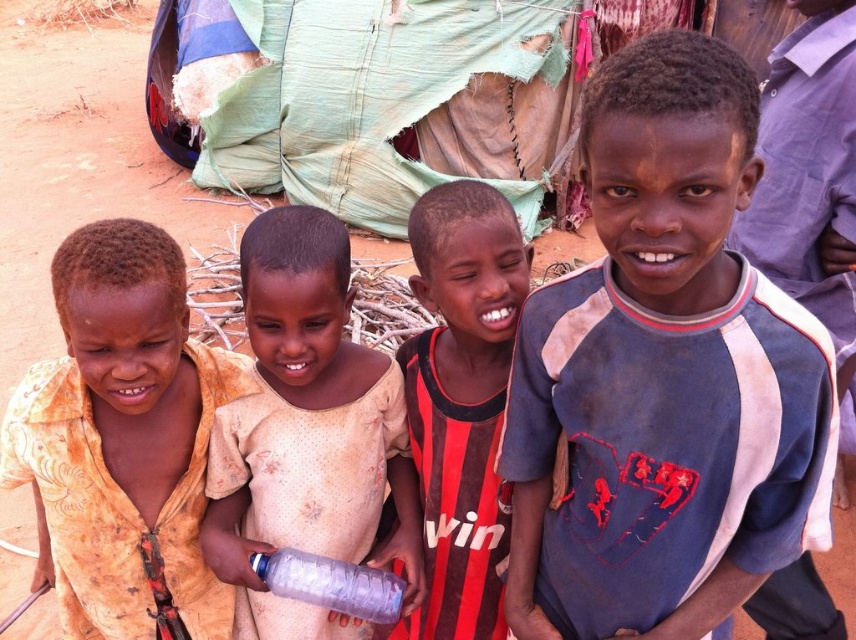
Can you confirm if yellow cotton shirt at left is wider than light brown fabric shirt at center?

Yes.

Does yellow cotton shirt at left lie behind light brown fabric shirt at center?

No, yellow cotton shirt at left is in front of light brown fabric shirt at center.

Is point (141, 509) more distant than point (354, 497)?

No.

The image size is (856, 640). I want to click on yellow cotton shirt at left, so click(x=122, y=442).

Is blue cotton shirt at center bigger than yellow cotton shirt at left?

No.

Does blue cotton shirt at center lie behind yellow cotton shirt at left?

No.

Who is more distant from viewer, (639, 38) or (153, 362)?

The point (153, 362) is more distant.

Image resolution: width=856 pixels, height=640 pixels. Find the location of `blue cotton shirt at center`. blue cotton shirt at center is located at coordinates (664, 376).

Consider the image. Can you confirm if blue cotton shirt at center is positioned to the left of transparent plastic bottle at lower center?

In fact, blue cotton shirt at center is to the right of transparent plastic bottle at lower center.

This screenshot has width=856, height=640. I want to click on blue cotton shirt at center, so click(664, 376).

What do you see at coordinates (664, 376) in the screenshot? I see `blue cotton shirt at center` at bounding box center [664, 376].

Find the location of `blue cotton shirt at center`. blue cotton shirt at center is located at coordinates (664, 376).